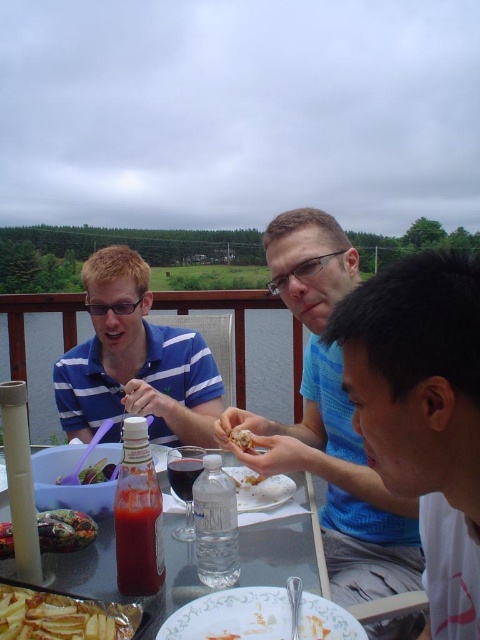
Is white porcelain plate at lower center further to the viewer compared to golden crispy fries at lower left?

Yes, white porcelain plate at lower center is behind golden crispy fries at lower left.

Is point (182, 605) less distant than point (38, 627)?

No.

Identify the location of white porcelain plate at lower center. The height and width of the screenshot is (640, 480). (232, 616).

Is clear glass table at center closer to the viewer compared to golden crispy chicken at center?

Yes, it is.

Does point (231, 461) come in front of point (245, 440)?

No.

At what (x,y) coordinates should I click in order to perform the action: click on clear glass table at center. Please return your answer as a coordinate pair (x, y). This screenshot has width=480, height=640. Looking at the image, I should click on (284, 547).

Which is in front, point (311, 301) or point (248, 486)?

Point (248, 486) is more forward.

Which is behind, point (336, 397) or point (264, 488)?

The point (336, 397) is more distant.

Between point (300, 307) and point (252, 502), which one is positioned behind?

The point (300, 307) is more distant.

What are the coordinates of `blue matte shirt at center` in the screenshot? It's located at (331, 420).